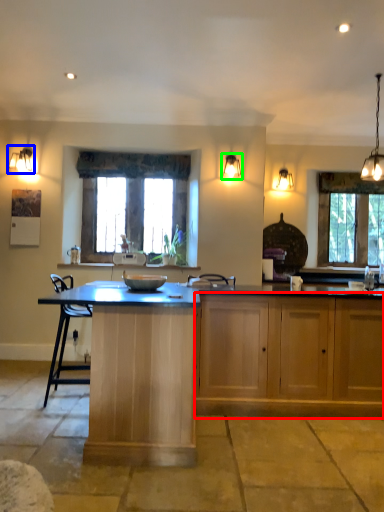
Question: Estimate the real-world distances between objects in this image. Which object is farther from cabinetry (highlighted by a red box), lamp (highlighted by a blue box) or lamp (highlighted by a green box)?

Choices:
 (A) lamp
 (B) lamp

Answer: (A)